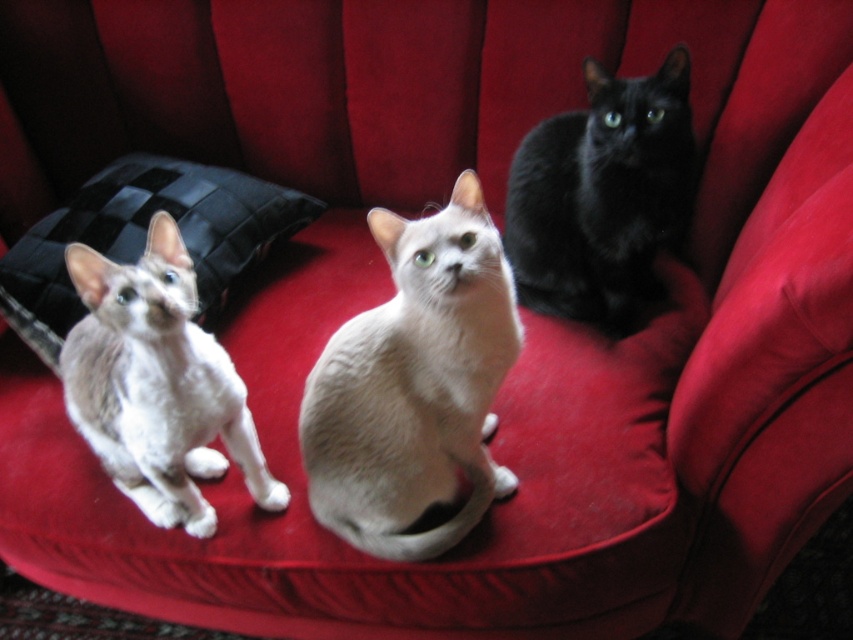
Between white matte cat at center and black quilted pillow at left, which one is positioned lower?

white matte cat at center

Between point (361, 490) and point (254, 179), which one is positioned behind?

Positioned behind is point (254, 179).

Where is `white matte cat at center`? The image size is (853, 640). white matte cat at center is located at coordinates (415, 385).

Who is taller, white matte cat at center or black silky cat at upper right?

Standing taller between the two is white matte cat at center.

Describe the element at coordinates (415, 385) in the screenshot. I see `white matte cat at center` at that location.

Find the location of `white matte cat at center`. white matte cat at center is located at coordinates (415, 385).

Looking at this image, is silvery white fur cat at left smaller than black quilted pillow at left?

Yes, silvery white fur cat at left is smaller than black quilted pillow at left.

Who is shorter, silvery white fur cat at left or black quilted pillow at left?

black quilted pillow at left is shorter.

Identify the location of silvery white fur cat at left. Image resolution: width=853 pixels, height=640 pixels. (157, 385).